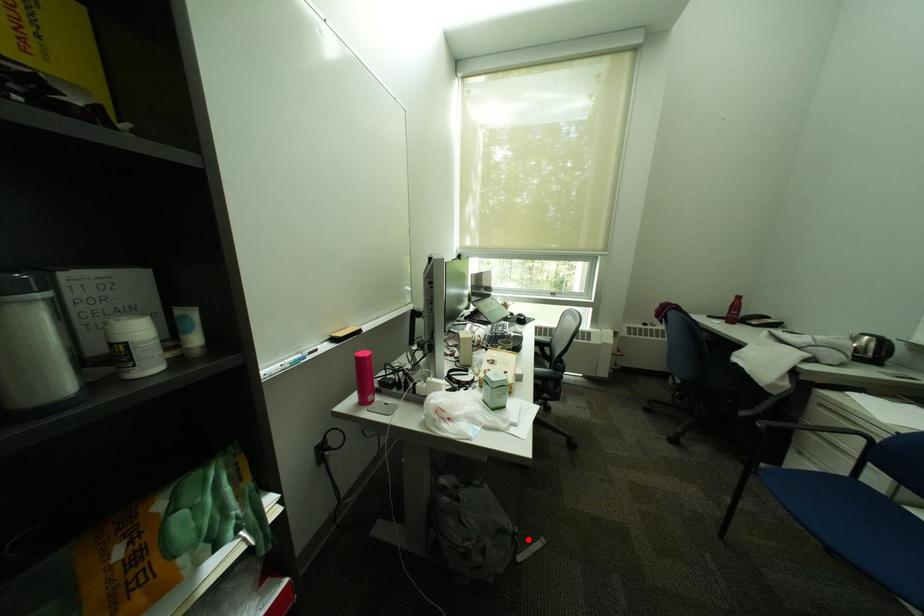
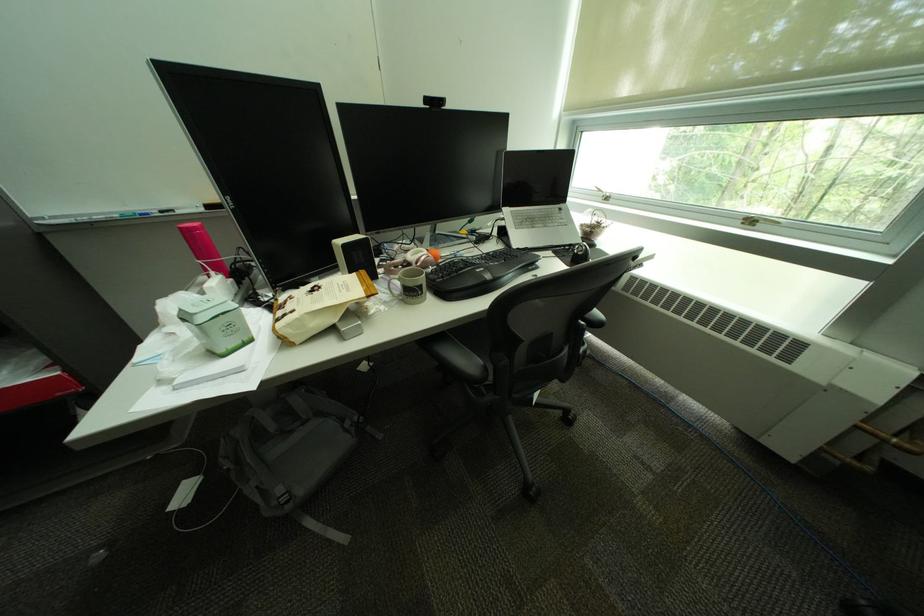
Question: I am providing you with two images of the same scene from different viewpoints. In image1, a red point is highlighted. Considering the same 3D point in image2, which of the following is correct?

Choices:
 (A) It is closer
 (B) It is farther

Answer: (B)